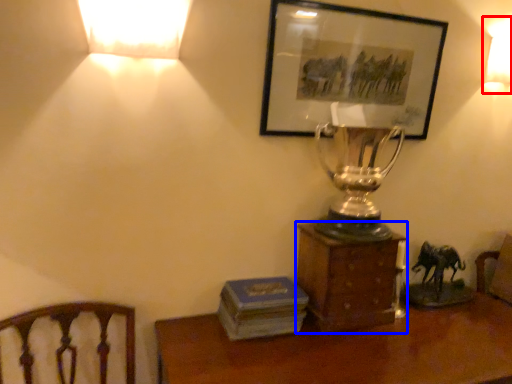
Question: Among these objects, which one is nearest to the camera, lamp (highlighted by a red box) or furniture (highlighted by a blue box)?

Choices:
 (A) lamp
 (B) furniture

Answer: (B)